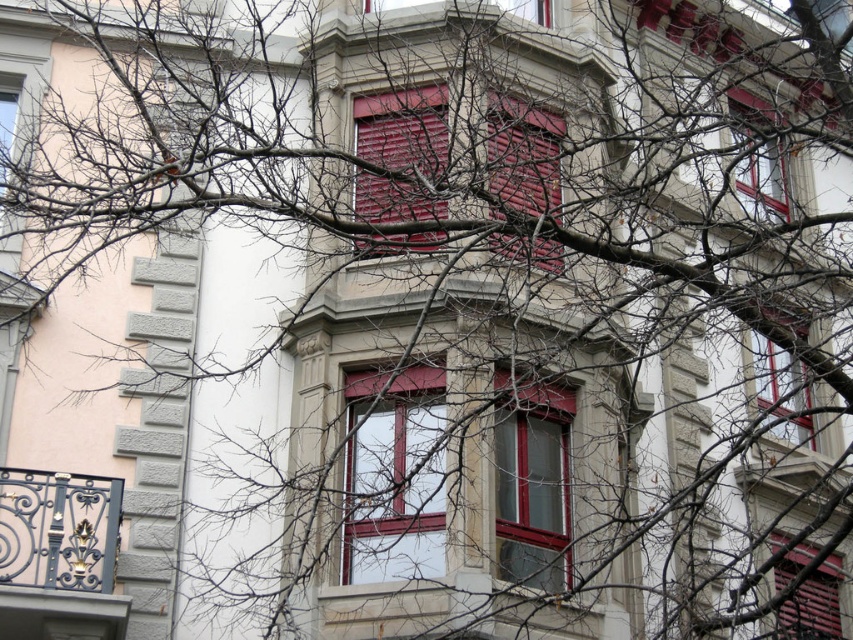
Question: Which point is closer to the camera?

Choices:
 (A) matte red shutter at center
 (B) matte glass window at upper right
 (C) matte glass window at center
 (D) matte wood shutter at center

Answer: (D)

Question: Does matte glass window at center have a larger size compared to matte red shutter at center?

Choices:
 (A) no
 (B) yes

Answer: (A)

Question: Is matte red shutter at center above matte red shutter at lower right?

Choices:
 (A) no
 (B) yes

Answer: (B)

Question: Which point is farther to the camera?

Choices:
 (A) matte wood shutter at center
 (B) matte glass window at upper left
 (C) matte red window at upper right

Answer: (C)

Question: Is matte wood shutter at center positioned at the back of matte red shutter at lower right?

Choices:
 (A) yes
 (B) no

Answer: (B)

Question: Which point is farther to the camera?

Choices:
 (A) matte red shutter at center
 (B) matte red window at upper right
 (C) matte red window at center
 (D) matte glass window at upper left

Answer: (C)